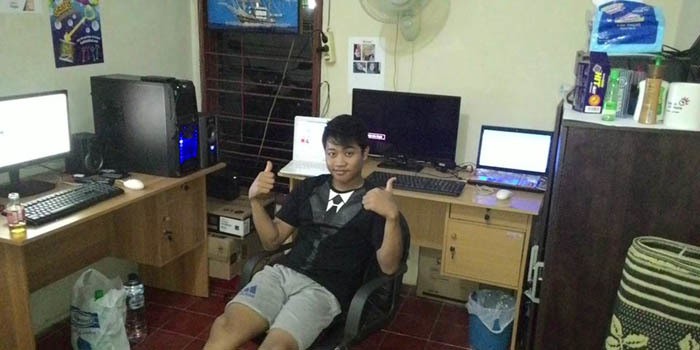
Where is `office chair`? The height and width of the screenshot is (350, 700). office chair is located at coordinates (374, 318).